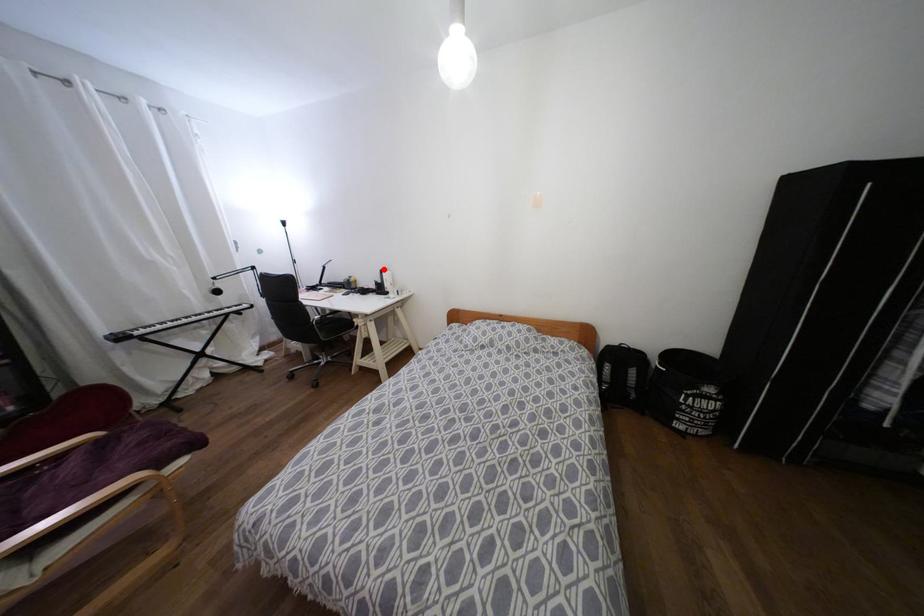
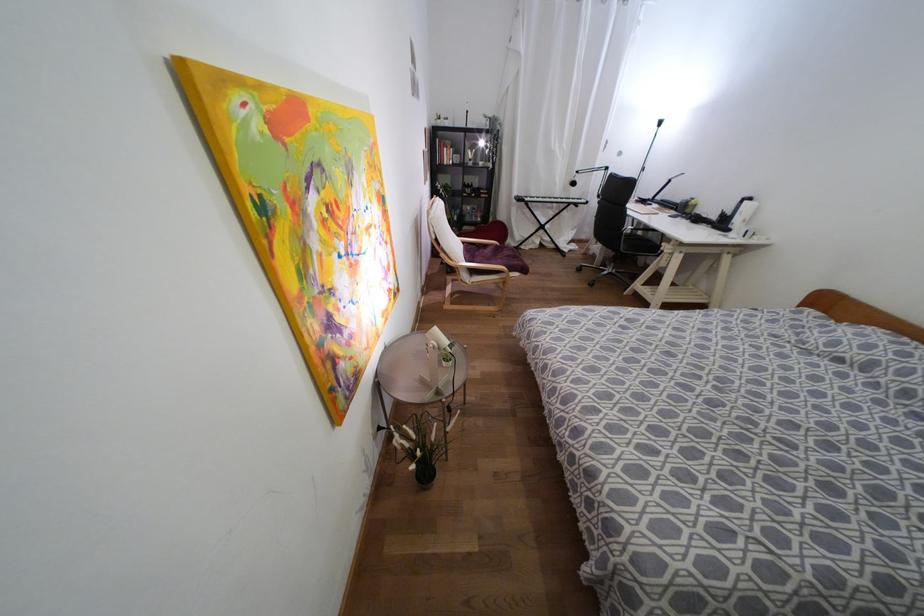
Find the pixel in the second image that matches the highlighted location in the first image.

(749, 198)